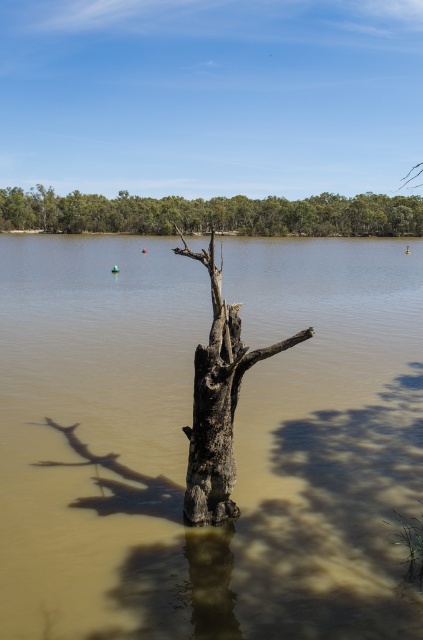
Question: Which object is the farthest from the green leafy trees at upper center?

Choices:
 (A) charcoal rough tree trunk at center
 (B) brown muddy water at center

Answer: (A)

Question: Observing the image, what is the correct spatial positioning of brown muddy water at center in reference to charcoal rough tree trunk at center?

Choices:
 (A) left
 (B) right

Answer: (A)

Question: Which point appears farthest from the camera in this image?

Choices:
 (A) (236, 227)
 (B) (222, 380)

Answer: (A)

Question: Is brown muddy water at center thinner than green leafy trees at upper center?

Choices:
 (A) no
 (B) yes

Answer: (B)

Question: Is green leafy trees at upper center positioned at the back of charcoal rough tree trunk at center?

Choices:
 (A) yes
 (B) no

Answer: (A)

Question: Which point is farther from the camera taking this photo?

Choices:
 (A) [x=329, y=243]
 (B) [x=96, y=209]

Answer: (B)